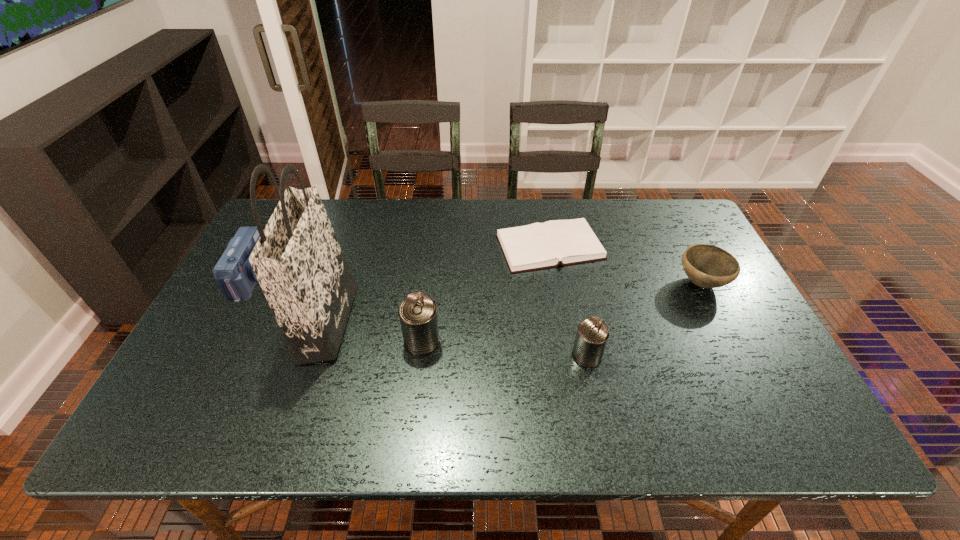
Find the location of a particular element. vacant space in between the right can and the fifth tallest object is located at coordinates (644, 320).

Identify the location of empty location between the taller can and the second shortest object. The image size is (960, 540). (x=562, y=312).

Image resolution: width=960 pixels, height=540 pixels. What are the coordinates of `empty location between the shortest object and the bowl` in the screenshot? It's located at (626, 265).

Where is `vacant region between the shortest object and the right can`? vacant region between the shortest object and the right can is located at coordinates (568, 301).

What are the coordinates of `vacant region between the taller can and the shortest object` in the screenshot? It's located at (486, 294).

Locate an element on the screen. Image resolution: width=960 pixels, height=540 pixels. unoccupied position between the left can and the hardback book is located at coordinates (486, 294).

This screenshot has height=540, width=960. I want to click on the closest object relative to the shorter can, so click(536, 246).

Image resolution: width=960 pixels, height=540 pixels. I want to click on object that is the fifth nearest to the bowl, so click(x=233, y=272).

Identify the location of vacant space that satisfies the following two spatial constraints: 1. on the lens of the leftmost object; 2. on the left side of the shorter can. (210, 356).

This screenshot has width=960, height=540. What are the coordinates of `free point that satisfies the following two spatial constraints: 1. on the front side of the shortest object; 2. on the front of the shopping bag with the design` in the screenshot? It's located at (563, 322).